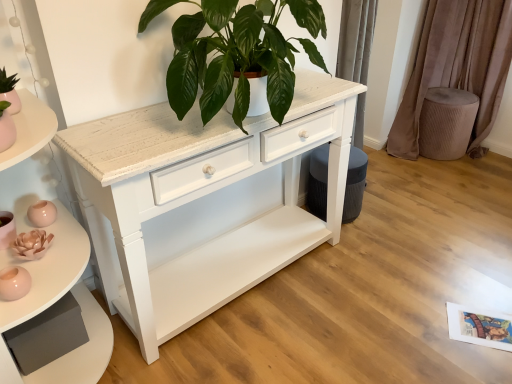
What is the approximate height of green matte plant at center?

green matte plant at center is 43.75 centimeters in height.

The height and width of the screenshot is (384, 512). What are the coordinates of `green matte plant at center` in the screenshot? It's located at (234, 53).

What do you see at coordinates (201, 202) in the screenshot? I see `white wood chest of drawers at center` at bounding box center [201, 202].

Where is `velvet taupe stool at right`? The width and height of the screenshot is (512, 384). velvet taupe stool at right is located at coordinates (446, 122).

Describe the element at coordinates (457, 66) in the screenshot. I see `velvet taupe curtain at right` at that location.

Describe the element at coordinates (56, 301) in the screenshot. I see `white painted wood shelf at left` at that location.

Where is `green matte plant at center`? green matte plant at center is located at coordinates (234, 53).

Is white wood chest of drawers at center at the back of green matte plant at center?

No, white wood chest of drawers at center is not at the back of green matte plant at center.

This screenshot has height=384, width=512. In the image, there is a green matte plant at center. Identify the location of the chest of drawers below it (from the image's perspective). (201, 202).

Looking at this image, in terms of height, does green matte plant at center look taller or shorter compared to white wood chest of drawers at center?

green matte plant at center is taller than white wood chest of drawers at center.

Which object is positioned more to the left, green matte plant at center or white wood chest of drawers at center?

Positioned to the left is green matte plant at center.

In terms of height, does velvet taupe stool at right look taller or shorter compared to white painted wood shelf at left?

Considering their sizes, velvet taupe stool at right has less height than white painted wood shelf at left.

Does point (428, 139) come in front of point (21, 125)?

No, (428, 139) is further to viewer.

From a real-world perspective, which object rests below the other?

velvet taupe stool at right, from a real-world perspective.

How many degrees apart are the facing directions of velvet taupe stool at right and white painted wood shelf at left?

They differ by 9.46 degrees in their facing directions.

Considering the positions of objects white painted wood shelf at left and velvet taupe stool at right in the image provided, who is more to the left, white painted wood shelf at left or velvet taupe stool at right?

Positioned to the left is white painted wood shelf at left.

Is white painted wood shelf at left smaller than velvet taupe stool at right?

Incorrect, white painted wood shelf at left is not smaller in size than velvet taupe stool at right.

Is white painted wood shelf at left situated inside velvet taupe stool at right or outside?

white painted wood shelf at left is outside velvet taupe stool at right.

From a real-world perspective, relative to velvet taupe stool at right, is white painted wood shelf at left vertically above or below?

In terms of real-world spatial position, white painted wood shelf at left is above velvet taupe stool at right.

Considering the relative positions of green matte plant at center and white painted wood shelf at left in the image provided, is green matte plant at center to the left or to the right of white painted wood shelf at left?

green matte plant at center is positioned on white painted wood shelf at left's right side.

Is green matte plant at center oriented towards white painted wood shelf at left?

No.

Is green matte plant at center inside or outside of white painted wood shelf at left?

green matte plant at center lies outside white painted wood shelf at left.

Is green matte plant at center far from white painted wood shelf at left?

No.

Is velvet taupe stool at right in front of or behind velvet taupe curtain at right in the image?

Answer: Visually, velvet taupe stool at right is located behind velvet taupe curtain at right.

Is point (448, 102) positioned behind point (412, 106)?

No, it is in front of (412, 106).

Which of these two, velvet taupe stool at right or velvet taupe curtain at right, stands taller?

velvet taupe curtain at right.

In terms of size, does velvet taupe stool at right appear bigger or smaller than velvet taupe curtain at right?

In the image, velvet taupe stool at right appears to be smaller than velvet taupe curtain at right.

Is velvet taupe stool at right to the right of green matte plant at center from the viewer's perspective?

Yes.

Does point (431, 138) come closer to viewer compared to point (276, 82)?

No.

Who is smaller, velvet taupe stool at right or green matte plant at center?

velvet taupe stool at right.

Find the location of a particular element. This screenshot has width=512, height=384. stool that is on the right side of green matte plant at center is located at coordinates (446, 122).

Is white painted wood shelf at left looking in the opposite direction of velvet taupe curtain at right?

No, white painted wood shelf at left is not facing the opposite direction of velvet taupe curtain at right.

Is white painted wood shelf at left closer to camera compared to velvet taupe curtain at right?

Yes.

Is white painted wood shelf at left with velvet taupe curtain at right?

No.

Locate an element on the screen. the chest of drawers that is below the green matte plant at center (from the image's perspective) is located at coordinates (201, 202).

Identify the location of shelf that is on the left side of velvet taupe stool at right. (56, 301).

When comparing their distances from velvet taupe curtain at right, does white painted wood shelf at left or velvet taupe stool at right seem closer?

velvet taupe stool at right lies closer to velvet taupe curtain at right than the other object.

Which object lies nearer to the anchor point white wood chest of drawers at center, white painted wood shelf at left or velvet taupe curtain at right?

white painted wood shelf at left is closer to white wood chest of drawers at center.

When comparing their distances from velvet taupe curtain at right, does green matte plant at center or white wood chest of drawers at center seem closer?

white wood chest of drawers at center is closer to velvet taupe curtain at right.

From the picture: Which object lies further to the anchor point white wood chest of drawers at center, white painted wood shelf at left or velvet taupe stool at right?

Based on the image, velvet taupe stool at right appears to be further to white wood chest of drawers at center.

Considering their positions, is white painted wood shelf at left positioned closer to green matte plant at center than velvet taupe curtain at right?

white painted wood shelf at left.

Considering their positions, is white wood chest of drawers at center positioned further to white painted wood shelf at left than velvet taupe stool at right?

The object further to white painted wood shelf at left is velvet taupe stool at right.

Based on their spatial positions, is velvet taupe stool at right or white wood chest of drawers at center closer to white painted wood shelf at left?

white wood chest of drawers at center is closer to white painted wood shelf at left.

From the image, which object appears to be farther from velvet taupe stool at right, white painted wood shelf at left or green matte plant at center?

white painted wood shelf at left.

Image resolution: width=512 pixels, height=384 pixels. Identify the location of the chest of drawers situated between white painted wood shelf at left and velvet taupe curtain at right from left to right. (201, 202).

Where is `chest of drawers between white painted wood shelf at left and velvet taupe stool at right in the front-back direction`? chest of drawers between white painted wood shelf at left and velvet taupe stool at right in the front-back direction is located at coordinates (201, 202).

Where is `houseplant located between white painted wood shelf at left and white wood chest of drawers at center in the left-right direction`? The width and height of the screenshot is (512, 384). houseplant located between white painted wood shelf at left and white wood chest of drawers at center in the left-right direction is located at coordinates (234, 53).

Where is `houseplant between white painted wood shelf at left and velvet taupe stool at right along the z-axis`? houseplant between white painted wood shelf at left and velvet taupe stool at right along the z-axis is located at coordinates (234, 53).